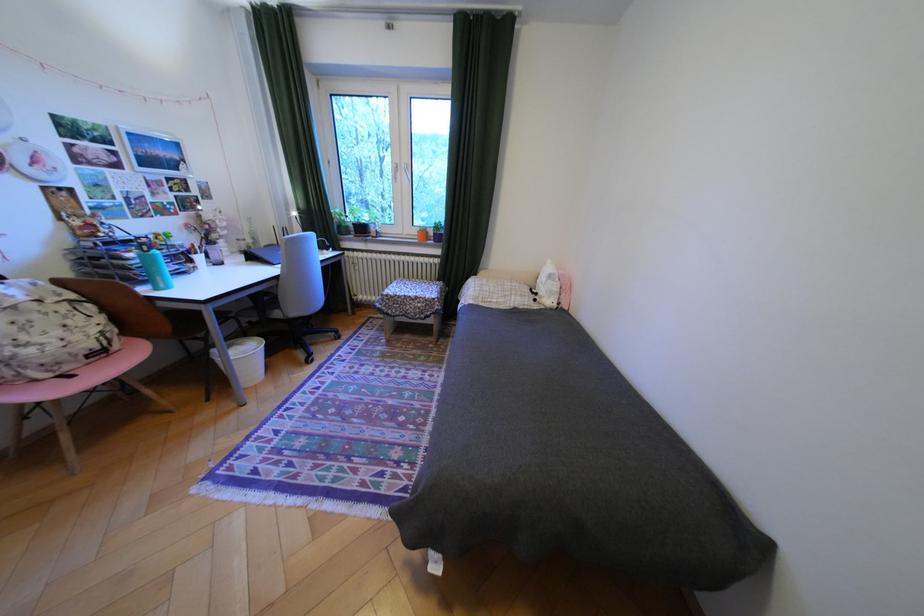
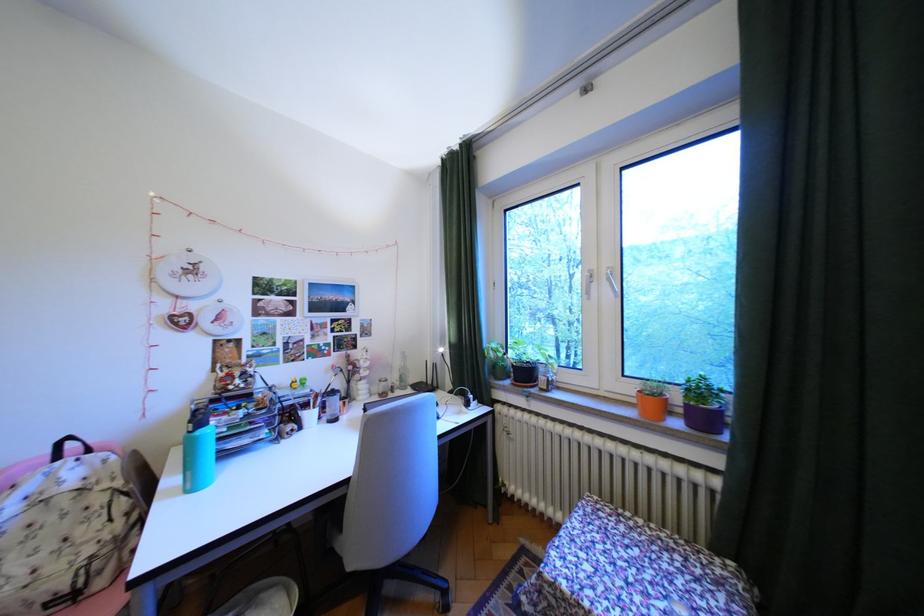
Find the pixel in the second image that matches the point at 427,232 in the first image.

(641, 390)